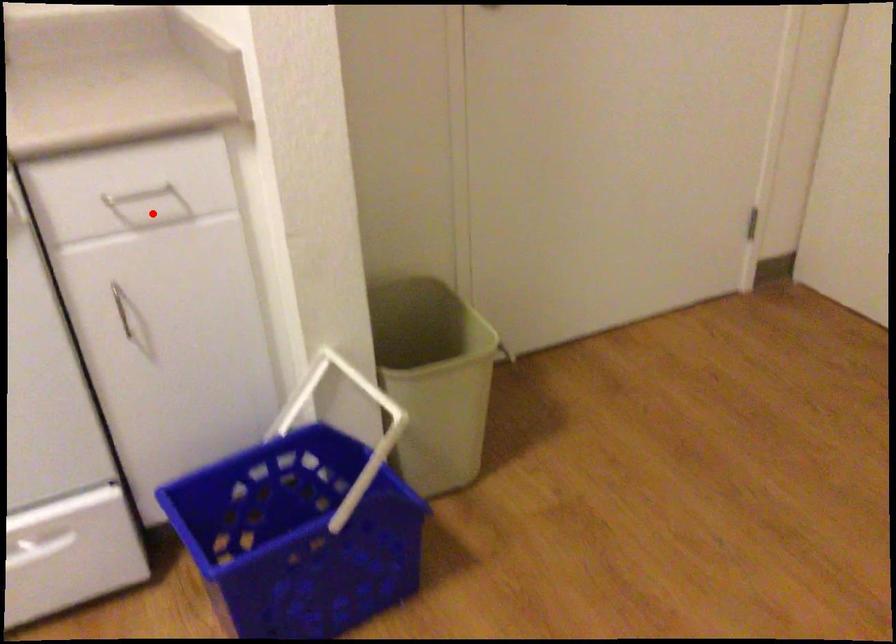
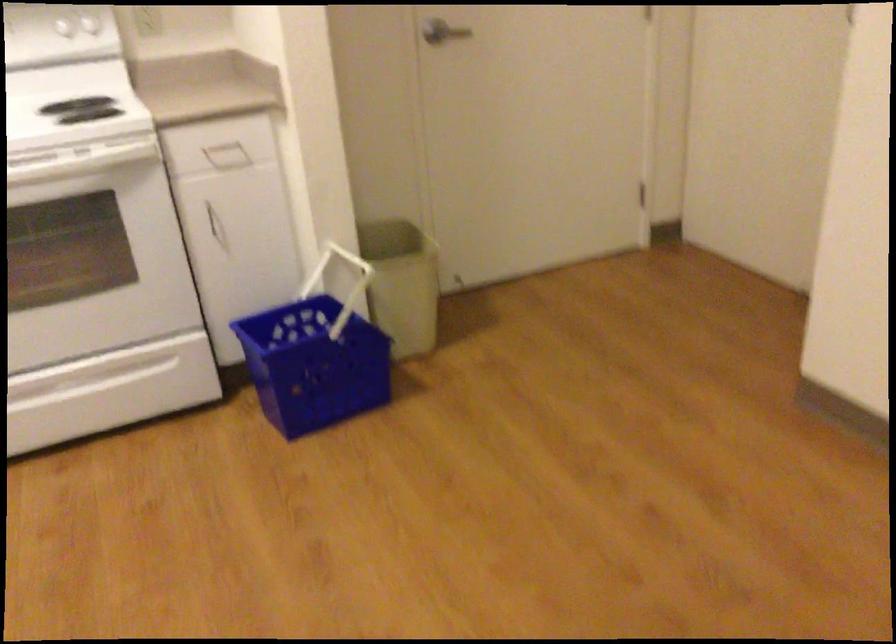
Question: I am providing you with two images of the same scene from different viewpoints. In image1, a red point is highlighted. Considering the same 3D point in image2, which of the following is correct?

Choices:
 (A) It is closer
 (B) It is farther

Answer: (B)